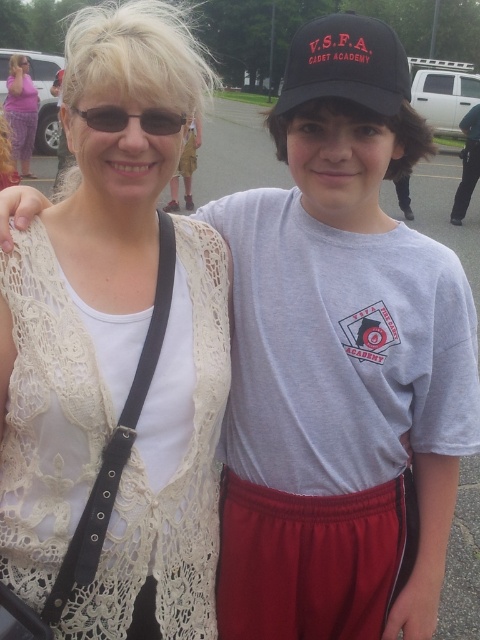
You are a photographer trying to focus on the matte purple dress at upper left and the matte black sunglasses at upper left. Which object should you adjust your camera to focus on first if you want to capture both in sharp detail?

The matte purple dress at upper left is located above the matte black sunglasses at upper left. Since the dress is higher up, you should focus on the matte purple dress at upper left first to ensure both are in focus.

You are taking a photo of two people standing in front of you. There are two points marked in the image. The first point is at coordinates point (358, 92) and the second point is at point (182, 120). Which point is closer to you?

Point (358, 92) is closer to the viewer than point (182, 120).

You are a photographer trying to capture a closeup of the matte purple dress at upper left and the matte black sunglasses at upper left. Since the dress is to the left of the sunglasses, which object should you focus on first if you start from the left side?

The matte purple dress at upper left should be focused on first since it is positioned to the left of the matte black sunglasses at upper left.